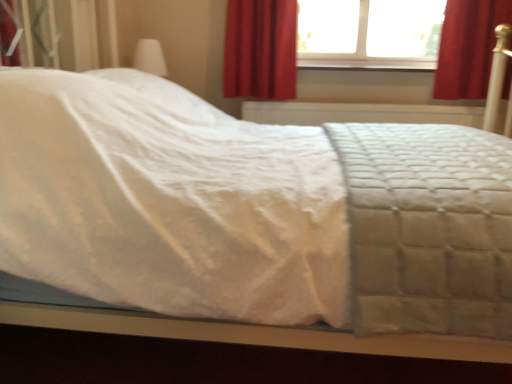
Question: From the image's perspective, is red velvet curtain at upper right, the 1th curtain when ordered from right to left, over transparent glass window at upper center?

Choices:
 (A) no
 (B) yes

Answer: (A)

Question: Considering the relative sizes of red velvet curtain at upper right, the second curtain when ordered from left to right, and transparent glass window at upper center in the image provided, is red velvet curtain at upper right, the second curtain when ordered from left to right, taller than transparent glass window at upper center?

Choices:
 (A) no
 (B) yes

Answer: (B)

Question: Can you confirm if red velvet curtain at upper right, the 1th curtain when ordered from right to left, is smaller than transparent glass window at upper center?

Choices:
 (A) no
 (B) yes

Answer: (A)

Question: Can you see red velvet curtain at upper right, the 1th curtain when ordered from right to left, touching transparent glass window at upper center?

Choices:
 (A) no
 (B) yes

Answer: (A)

Question: Does red velvet curtain at upper right, the second curtain when ordered from left to right, have a larger size compared to transparent glass window at upper center?

Choices:
 (A) yes
 (B) no

Answer: (A)

Question: Would you say transparent glass window at upper center is part of red velvet curtain at upper right, the second curtain when ordered from left to right,'s contents?

Choices:
 (A) yes
 (B) no

Answer: (B)

Question: Can you confirm if smooth wood window sill at upper center is smaller than transparent glass window at upper center?

Choices:
 (A) no
 (B) yes

Answer: (B)

Question: Is smooth wood window sill at upper center at the left side of transparent glass window at upper center?

Choices:
 (A) no
 (B) yes

Answer: (A)

Question: Is smooth wood window sill at upper center oriented away from transparent glass window at upper center?

Choices:
 (A) yes
 (B) no

Answer: (A)

Question: From the image's perspective, is smooth wood window sill at upper center on top of transparent glass window at upper center?

Choices:
 (A) yes
 (B) no

Answer: (B)

Question: From a real-world perspective, is smooth wood window sill at upper center located higher than transparent glass window at upper center?

Choices:
 (A) yes
 (B) no

Answer: (B)

Question: Is smooth wood window sill at upper center aimed at transparent glass window at upper center?

Choices:
 (A) yes
 (B) no

Answer: (B)

Question: Considering the relative sizes of red velvet curtain at upper right, the 1th curtain when ordered from right to left, and white quilted fabric at center in the image provided, is red velvet curtain at upper right, the 1th curtain when ordered from right to left, thinner than white quilted fabric at center?

Choices:
 (A) no
 (B) yes

Answer: (B)